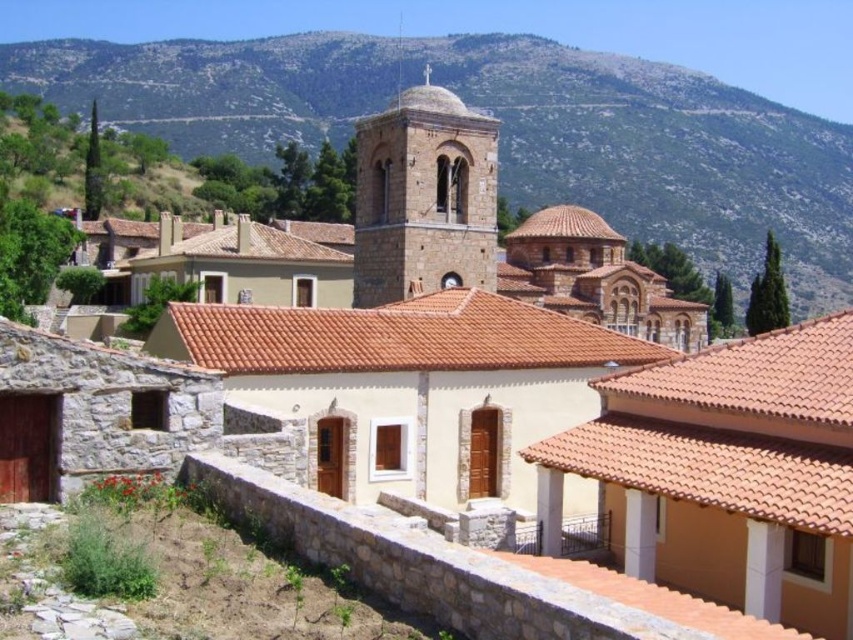
You are a drone operator tasked with capturing aerial footage of the village. Your drone can fly up to 250 meters away from its starting position. If you launch it from the terracotta tile roof at center, will it be able to fly over the green rocky mountain at upper center without exceeding its maximum range?

The distance between the green rocky mountain at upper center and the terracotta tile roof at center is 267.01 meters. Since the drone can only fly up to 250 meters, it will not be able to reach the green rocky mountain at upper center without exceeding its maximum range.